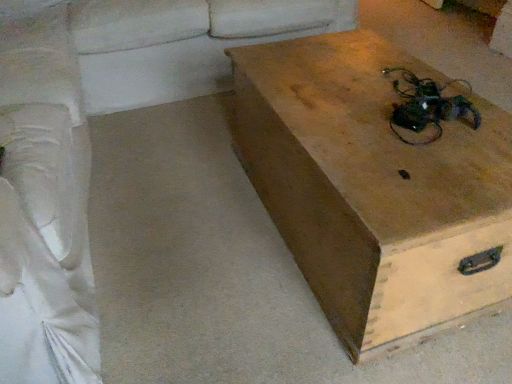
Describe the element at coordinates (90, 141) in the screenshot. Image resolution: width=512 pixels, height=384 pixels. I see `smooth beige couch at lower left` at that location.

Image resolution: width=512 pixels, height=384 pixels. Identify the location of white fabric couch at left, which ranks as the 1th couch in left-to-right order. (44, 207).

You are a GUI agent. You are given a task and a screenshot of the screen. Output one action in this format:
    pyautogui.click(x=<x>, y=<y>)
    Task: Click on the wooden box at center
    
    Given the screenshot: What is the action you would take?
    pyautogui.click(x=373, y=188)

Which of these two, white fabric couch at left, placed as the second couch when sorted from right to left, or white fabric couch at upper left, the second couch positioned from the left, is wider?

Wider between the two is white fabric couch at upper left, the second couch positioned from the left.

From a real-world perspective, between white fabric couch at left, placed as the second couch when sorted from right to left, and white fabric couch at upper left, the second couch positioned from the left, who is vertically lower?

white fabric couch at upper left, the second couch positioned from the left, from a real-world perspective.

I want to click on couch that is on the right side of white fabric couch at left, placed as the second couch when sorted from right to left, so click(182, 43).

Is white fabric couch at left, which ranks as the 1th couch in left-to-right order, far away from white fabric couch at upper left, the second couch positioned from the left?

white fabric couch at left, which ranks as the 1th couch in left-to-right order, is near white fabric couch at upper left, the second couch positioned from the left, not far away.

Which is more to the left, smooth beige couch at lower left or white fabric couch at left, which ranks as the 1th couch in left-to-right order?

white fabric couch at left, which ranks as the 1th couch in left-to-right order, is more to the left.

Relative to white fabric couch at left, placed as the second couch when sorted from right to left, is smooth beige couch at lower left in front or behind?

Clearly, smooth beige couch at lower left is behind white fabric couch at left, placed as the second couch when sorted from right to left.

The image size is (512, 384). Identify the location of studio couch above the white fabric couch at left, which ranks as the 1th couch in left-to-right order (from the image's perspective). (90, 141).

Between point (442, 318) and point (87, 371), which one is positioned behind?

Positioned behind is point (442, 318).

Which object is wider, wooden box at center or white fabric couch at left, which ranks as the 1th couch in left-to-right order?

wooden box at center is wider.

Is wooden box at center facing towards white fabric couch at left, which ranks as the 1th couch in left-to-right order?

No.

Can you confirm if wooden box at center is positioned to the right of white fabric couch at left, placed as the second couch when sorted from right to left?

Yes.

Consider the image. Is smooth beige couch at lower left oriented towards wooden box at center?

No, smooth beige couch at lower left does not turn towards wooden box at center.

From the picture: Are smooth beige couch at lower left and wooden box at center located far from each other?

Actually, smooth beige couch at lower left and wooden box at center are a little close together.

Which is behind, point (95, 4) or point (456, 225)?

The point (95, 4) is more distant.

Is white fabric couch at upper left, which appears as the 1th couch when viewed from the right, completely or partially outside of white fabric couch at left, placed as the second couch when sorted from right to left?

Yes, white fabric couch at upper left, which appears as the 1th couch when viewed from the right, is outside of white fabric couch at left, placed as the second couch when sorted from right to left.

Between white fabric couch at upper left, which appears as the 1th couch when viewed from the right, and white fabric couch at left, which ranks as the 1th couch in left-to-right order, which one is positioned in front?

white fabric couch at left, which ranks as the 1th couch in left-to-right order, is in front.

From the image's perspective, which object appears higher, white fabric couch at upper left, which appears as the 1th couch when viewed from the right, or white fabric couch at left, placed as the second couch when sorted from right to left?

white fabric couch at upper left, which appears as the 1th couch when viewed from the right, is shown above in the image.

Can you see white fabric couch at upper left, the second couch positioned from the left, touching white fabric couch at left, which ranks as the 1th couch in left-to-right order?

No, white fabric couch at upper left, the second couch positioned from the left, is not beside white fabric couch at left, which ranks as the 1th couch in left-to-right order.

Looking at the image, does white fabric couch at upper left, the second couch positioned from the left, seem bigger or smaller compared to wooden box at center?

In the image, white fabric couch at upper left, the second couch positioned from the left, appears to be larger than wooden box at center.

Image resolution: width=512 pixels, height=384 pixels. Identify the location of couch that is the 2nd object located above the wooden box at center (from the image's perspective). (182, 43).

From a real-world perspective, which is physically above, white fabric couch at upper left, which appears as the 1th couch when viewed from the right, or wooden box at center?

white fabric couch at upper left, which appears as the 1th couch when viewed from the right.

In the scene shown: Is wooden box at center surrounded by white fabric couch at upper left, the second couch positioned from the left?

That's incorrect, wooden box at center is not inside white fabric couch at upper left, the second couch positioned from the left.

Is wooden box at center not close to white fabric couch at upper left, which appears as the 1th couch when viewed from the right?

No.

From a real-world perspective, is wooden box at center under white fabric couch at upper left, the second couch positioned from the left?

Yes, from a real-world perspective, wooden box at center is below white fabric couch at upper left, the second couch positioned from the left.

Considering the sizes of wooden box at center and white fabric couch at upper left, which appears as the 1th couch when viewed from the right, in the image, is wooden box at center wider or thinner than white fabric couch at upper left, which appears as the 1th couch when viewed from the right,?

In the image, wooden box at center appears to be more narrow than white fabric couch at upper left, which appears as the 1th couch when viewed from the right.

What are the coordinates of `couch above the white fabric couch at left, placed as the second couch when sorted from right to left (from the image's perspective)` in the screenshot? It's located at [182, 43].

This screenshot has height=384, width=512. I want to click on studio couch on the right of the white fabric couch at left, which ranks as the 1th couch in left-to-right order, so click(x=90, y=141).

Which object lies nearer to the anchor point white fabric couch at left, which ranks as the 1th couch in left-to-right order, smooth beige couch at lower left or wooden box at center?

Based on the image, smooth beige couch at lower left appears to be nearer to white fabric couch at left, which ranks as the 1th couch in left-to-right order.

Consider the image. Considering their positions, is white fabric couch at upper left, which appears as the 1th couch when viewed from the right, positioned closer to white fabric couch at left, placed as the second couch when sorted from right to left, than wooden box at center?

wooden box at center.

Which object lies nearer to the anchor point wooden box at center, white fabric couch at left, placed as the second couch when sorted from right to left, or smooth beige couch at lower left?

Among the two, smooth beige couch at lower left is located nearer to wooden box at center.

Estimate the real-world distances between objects in this image. Which object is closer to smooth beige couch at lower left, white fabric couch at left, which ranks as the 1th couch in left-to-right order, or wooden box at center?

Based on the image, white fabric couch at left, which ranks as the 1th couch in left-to-right order, appears to be nearer to smooth beige couch at lower left.

In the scene shown: Looking at the image, which one is located further to white fabric couch at upper left, the second couch positioned from the left, white fabric couch at left, which ranks as the 1th couch in left-to-right order, or wooden box at center?

wooden box at center is positioned further to the anchor white fabric couch at upper left, the second couch positioned from the left.

Based on their spatial positions, is wooden box at center or smooth beige couch at lower left closer to white fabric couch at left, placed as the second couch when sorted from right to left?

smooth beige couch at lower left.

Looking at this image, looking at the image, which one is located further to smooth beige couch at lower left, white fabric couch at upper left, the second couch positioned from the left, or wooden box at center?

wooden box at center lies further to smooth beige couch at lower left than the other object.

Which object lies nearer to the anchor point white fabric couch at upper left, which appears as the 1th couch when viewed from the right, white fabric couch at left, which ranks as the 1th couch in left-to-right order, or smooth beige couch at lower left?

The object closer to white fabric couch at upper left, which appears as the 1th couch when viewed from the right, is smooth beige couch at lower left.

Find the location of a particular element. This screenshot has height=384, width=512. box located between smooth beige couch at lower left and white fabric couch at upper left, which appears as the 1th couch when viewed from the right, in the depth direction is located at coordinates (373, 188).

The width and height of the screenshot is (512, 384). Find the location of `box between white fabric couch at left, placed as the second couch when sorted from right to left, and white fabric couch at upper left, which appears as the 1th couch when viewed from the right, along the z-axis`. box between white fabric couch at left, placed as the second couch when sorted from right to left, and white fabric couch at upper left, which appears as the 1th couch when viewed from the right, along the z-axis is located at coordinates (373, 188).

Identify the location of box between white fabric couch at left, placed as the second couch when sorted from right to left, and smooth beige couch at lower left, in the horizontal direction. The width and height of the screenshot is (512, 384). (373, 188).

Image resolution: width=512 pixels, height=384 pixels. Find the location of `couch between white fabric couch at left, placed as the second couch when sorted from right to left, and smooth beige couch at lower left`. couch between white fabric couch at left, placed as the second couch when sorted from right to left, and smooth beige couch at lower left is located at coordinates (182, 43).